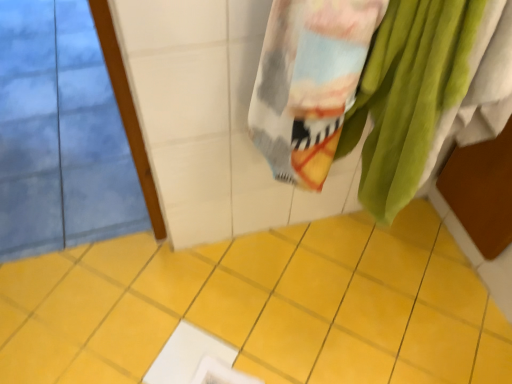
Question: Does point pyautogui.click(x=490, y=26) appear closer or farther from the camera than point pyautogui.click(x=240, y=301)?

Choices:
 (A) closer
 (B) farther

Answer: (A)

Question: From the image's perspective, is soft cotton towel at upper right located above or below yellow ceramic tile at center?

Choices:
 (A) above
 (B) below

Answer: (A)

Question: Looking at their shapes, would you say soft cotton towel at upper right is wider or thinner than yellow ceramic tile at center?

Choices:
 (A) thin
 (B) wide

Answer: (A)

Question: In terms of height, does yellow ceramic tile at center look taller or shorter compared to soft cotton towel at upper right?

Choices:
 (A) short
 (B) tall

Answer: (A)

Question: Is point (57, 347) positioned closer to the camera than point (422, 122)?

Choices:
 (A) closer
 (B) farther

Answer: (B)

Question: From the image's perspective, is yellow ceramic tile at center above or below soft cotton towel at upper right?

Choices:
 (A) above
 (B) below

Answer: (B)

Question: In the image, is yellow ceramic tile at center positioned in front of or behind soft cotton towel at upper right?

Choices:
 (A) behind
 (B) front

Answer: (A)